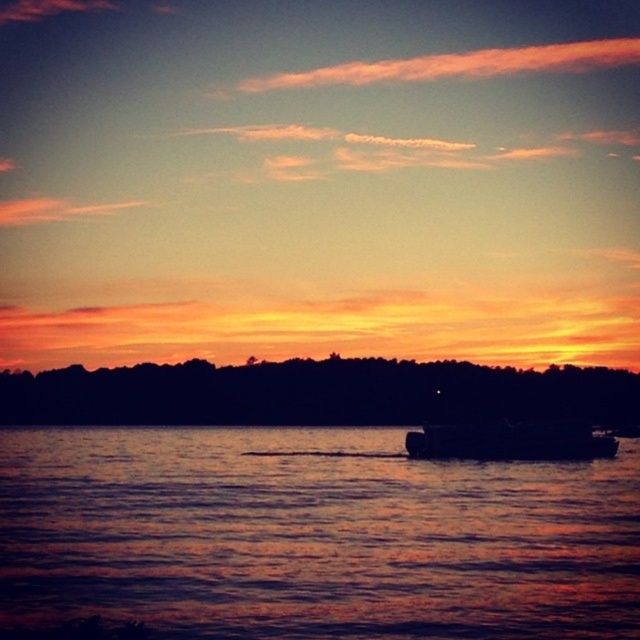
Between shiny reflective water at center and silhouetted trees at lower center, which one has more height?

silhouetted trees at lower center is taller.

Identify the location of shiny reflective water at center. This screenshot has height=640, width=640. (312, 536).

This screenshot has width=640, height=640. What do you see at coordinates (312, 536) in the screenshot?
I see `shiny reflective water at center` at bounding box center [312, 536].

I want to click on shiny reflective water at center, so click(x=312, y=536).

Can you confirm if silhouetted trees at lower center is positioned to the left of dark gray metallic boat at center?

Indeed, silhouetted trees at lower center is positioned on the left side of dark gray metallic boat at center.

Is point (237, 369) more distant than point (592, 442)?

Yes, it is behind point (592, 442).

Identify the location of silhouetted trees at lower center. The image size is (640, 640). (316, 394).

Which is more to the left, shiny reflective water at center or dark gray metallic boat at center?

From the viewer's perspective, shiny reflective water at center appears more on the left side.

Does shiny reflective water at center have a greater width compared to dark gray metallic boat at center?

Indeed, shiny reflective water at center has a greater width compared to dark gray metallic boat at center.

What do you see at coordinates (312, 536) in the screenshot?
I see `shiny reflective water at center` at bounding box center [312, 536].

Where is `shiny reflective water at center`? shiny reflective water at center is located at coordinates (312, 536).